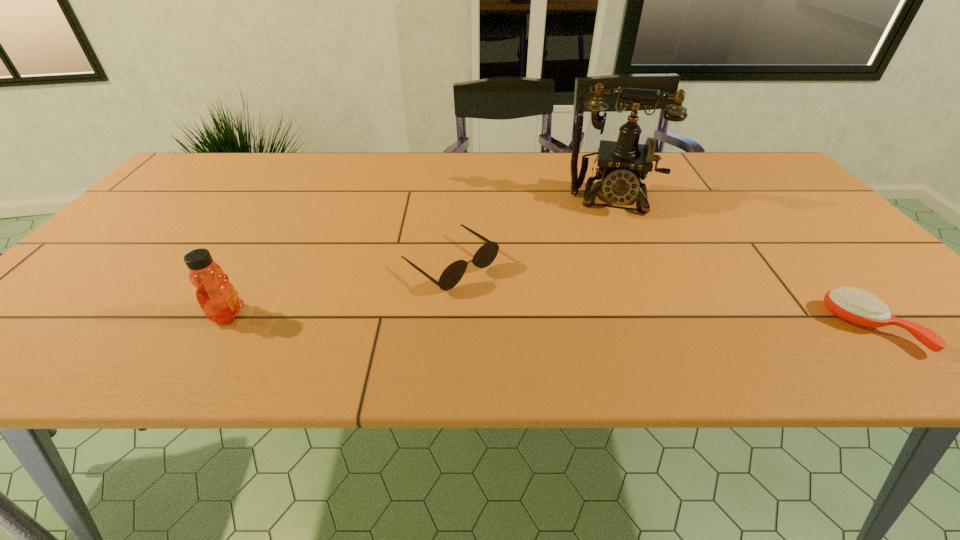
Where is `the leftmost object`? the leftmost object is located at coordinates (x=219, y=300).

You are a GUI agent. You are given a task and a screenshot of the screen. Output one action in this format:
    pyautogui.click(x=<x>, y=<y>)
    Task: Click on the honey
    This screenshot has width=960, height=540.
    Given the screenshot: What is the action you would take?
    pyautogui.click(x=219, y=300)

The image size is (960, 540). Identify the location of the rightmost object. (858, 307).

The image size is (960, 540). Identify the location of hairbrush. (858, 307).

The height and width of the screenshot is (540, 960). I want to click on the farthest object, so click(x=623, y=164).

The width and height of the screenshot is (960, 540). I want to click on the tallest object, so click(x=623, y=164).

Where is `the second farthest object`? The image size is (960, 540). the second farthest object is located at coordinates (486, 254).

Find the location of `sunglasses`. sunglasses is located at coordinates (486, 254).

Locate an element on the screen. Image resolution: width=960 pixels, height=540 pixels. vacant region located 0.230m on the front label of the leftmost object is located at coordinates (359, 315).

You are a GUI agent. You are given a task and a screenshot of the screen. Output one action in this format:
    pyautogui.click(x=<x>, y=<y>)
    Task: Click on the free space located on the back of the hairbrush
    The height and width of the screenshot is (540, 960).
    Given the screenshot: What is the action you would take?
    pyautogui.click(x=769, y=214)